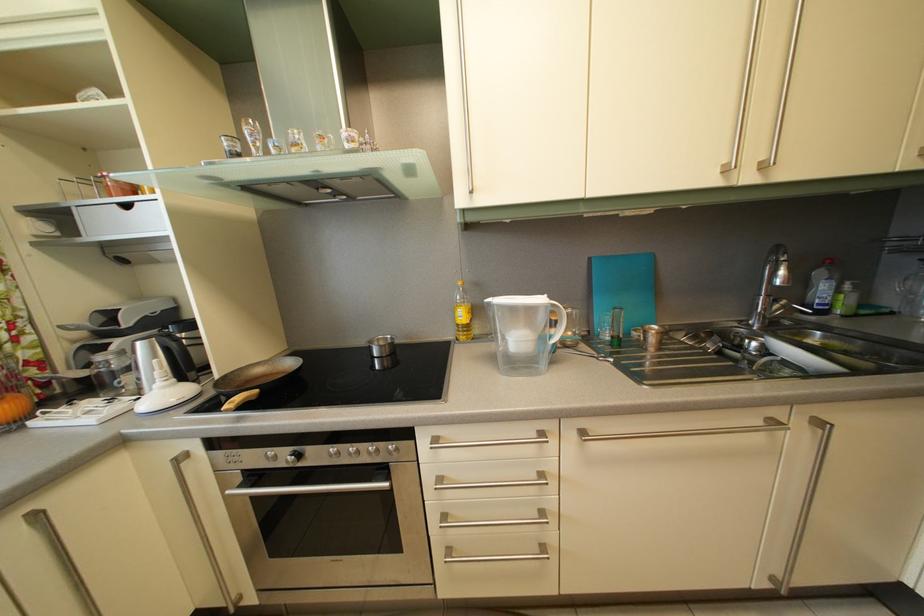
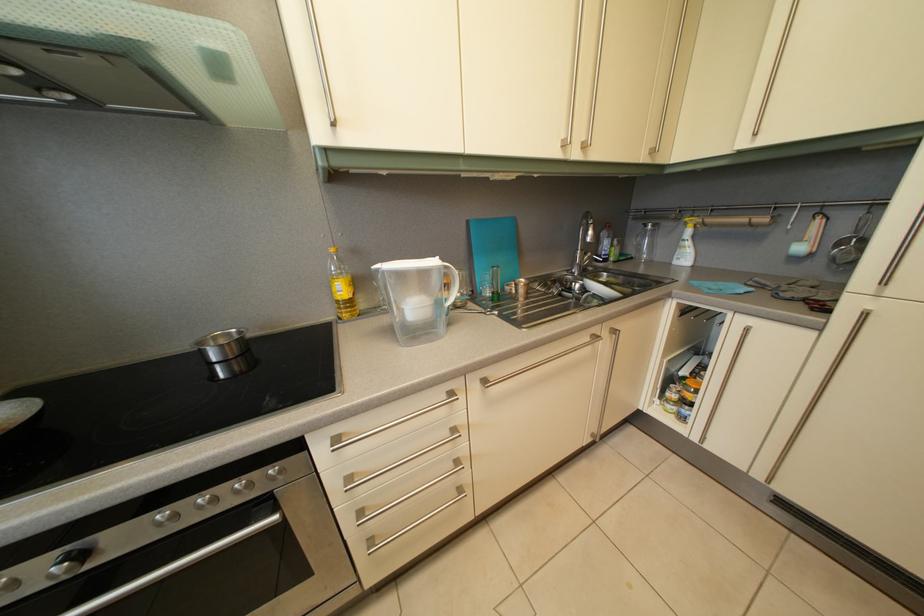
Find the pixel in the second image that matches pixel 470 323 in the first image.

(349, 297)